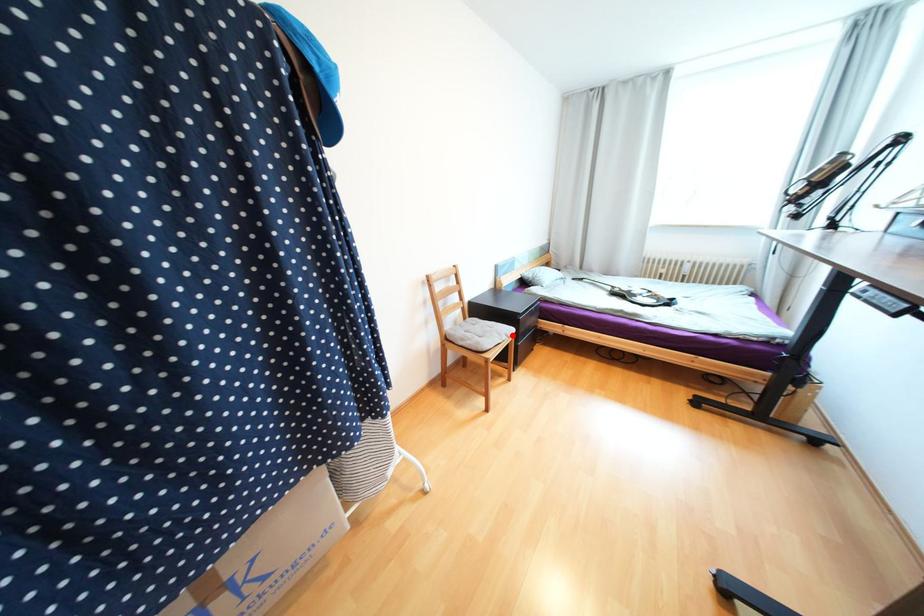
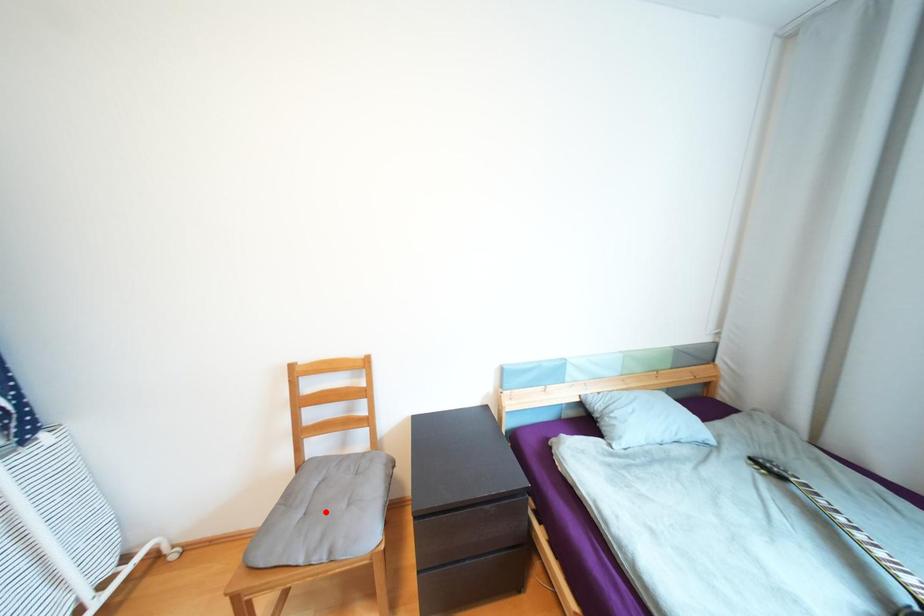
I am providing you with two images of the same scene from different viewpoints. A red point is marked on the first image and another point is marked on the second image. Do the highlighted points in image1 and image2 indicate the same real-world spot?

No